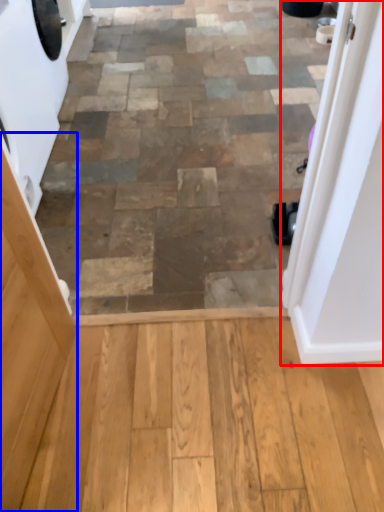
Question: Which object is closer to the camera taking this photo, door (highlighted by a red box) or screen door (highlighted by a blue box)?

Choices:
 (A) door
 (B) screen door

Answer: (B)